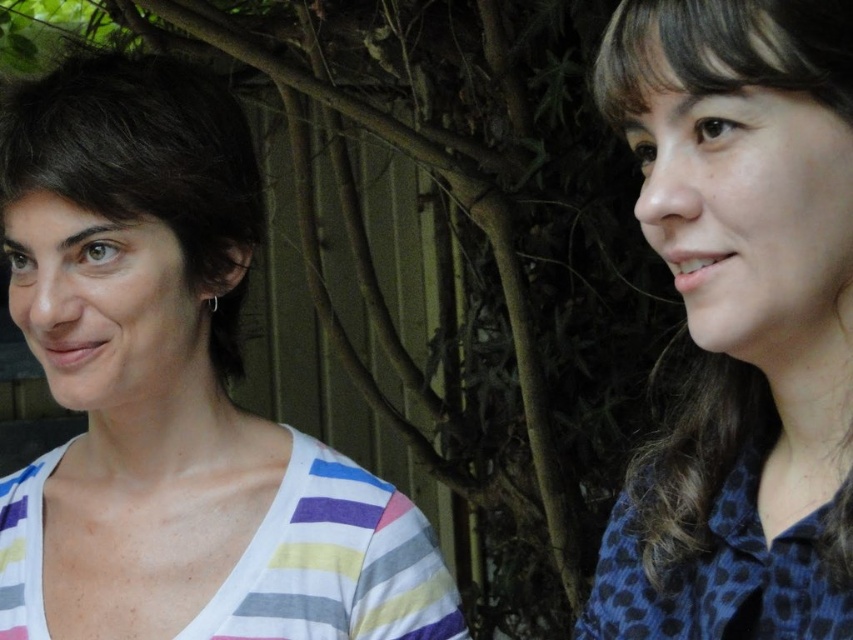
Question: Based on their relative distances, which object is nearer to the dark brown hair at left?

Choices:
 (A) white striped shirt at left
 (B) blue dotted shirt at right

Answer: (A)

Question: Does blue dotted shirt at right have a lesser width compared to dark brown hair at left?

Choices:
 (A) no
 (B) yes

Answer: (B)

Question: Can you confirm if white striped shirt at left is positioned above dark brown hair at left?

Choices:
 (A) yes
 (B) no

Answer: (B)

Question: Which point is farther to the camera?

Choices:
 (A) dark brown hair at left
 (B) blue dotted shirt at right

Answer: (A)

Question: Does blue dotted shirt at right appear over dark brown hair at left?

Choices:
 (A) yes
 (B) no

Answer: (B)

Question: Which object appears farthest from the camera in this image?

Choices:
 (A) dark brown hair at left
 (B) white striped shirt at left
 (C) blue dotted shirt at right

Answer: (B)